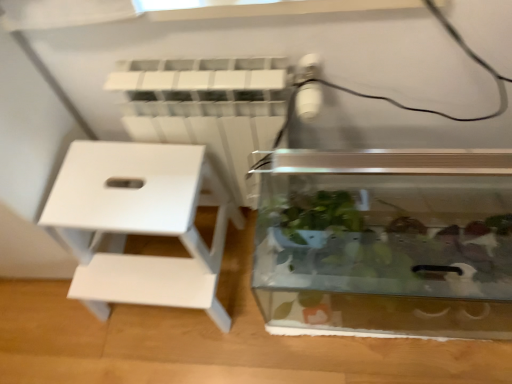
Find the location of a particular element. free space above white matte stool at left (from a real-world perspective) is located at coordinates (123, 186).